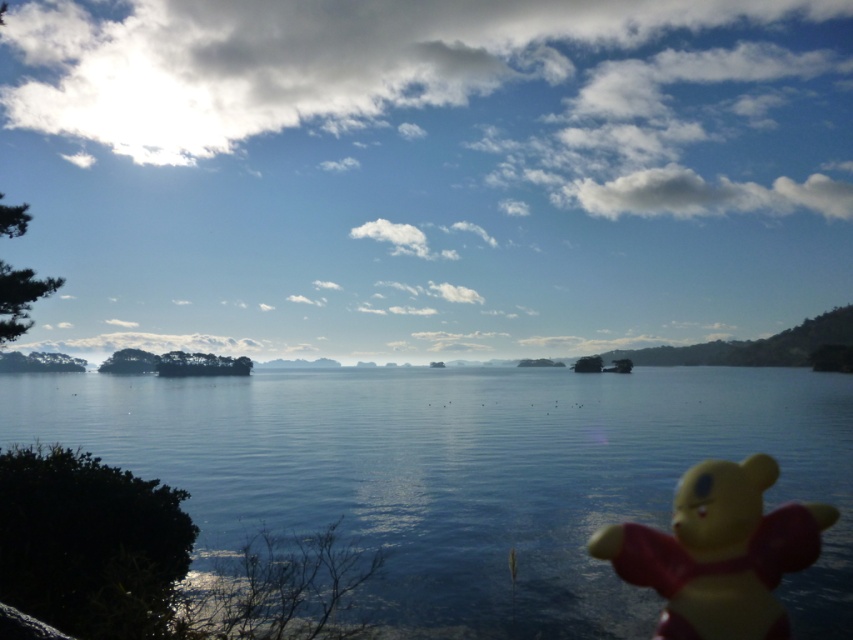
You are a GUI agent. You are given a task and a screenshot of the screen. Output one action in this format:
    pyautogui.click(x=<x>, y=<y>)
    Task: Click on the transparent water at center
    
    Given the screenshot: What is the action you would take?
    pyautogui.click(x=467, y=474)

Which is in front, point (463, 435) or point (601, 531)?

Point (601, 531) is in front.

Where is `transparent water at center`? transparent water at center is located at coordinates pyautogui.click(x=467, y=474).